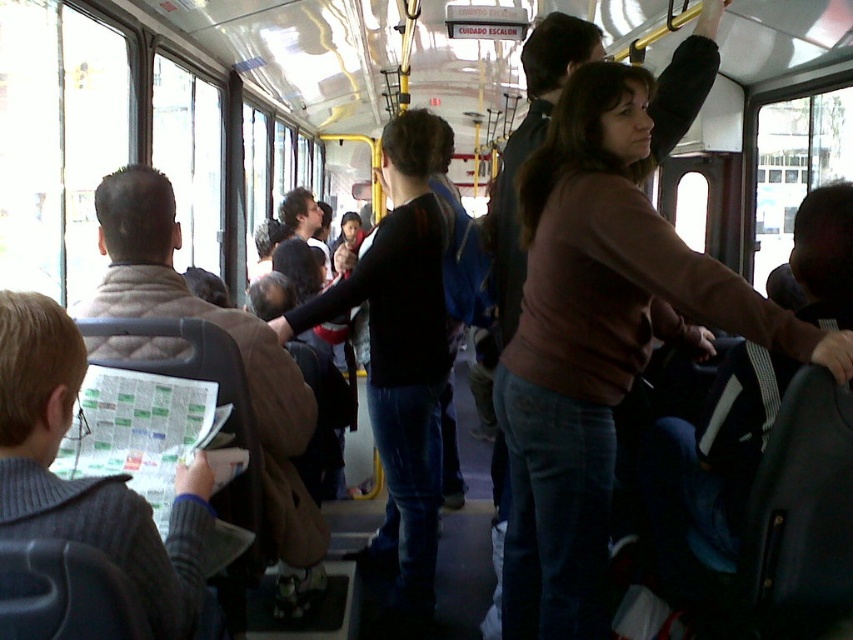
You are a bus passenger who needs to reach the brown matte sweater at upper center from the gray knitted sweater at left. Is the distance between them sufficient for you to comfortably walk through without needing to move any other passengers?

The distance between the brown matte sweater at upper center and the gray knitted sweater at left is 1.08 meters. Since this distance is narrow, it might be challenging to walk through comfortably without potentially disturbing nearby passengers, as typical personal space requirements are around 0.45 to 1.2 meters. However, since the bus is crowded, there might be other passengers in between that aren mentioned in the scene description, so it depends on the actual layout.

You are standing on the bus and see the brown matte sweater at upper center and the dark blue jeans at center. Which one is positioned more to the right side of the bus?

The brown matte sweater at upper center is positioned more to the right side of the bus than the dark blue jeans at center.